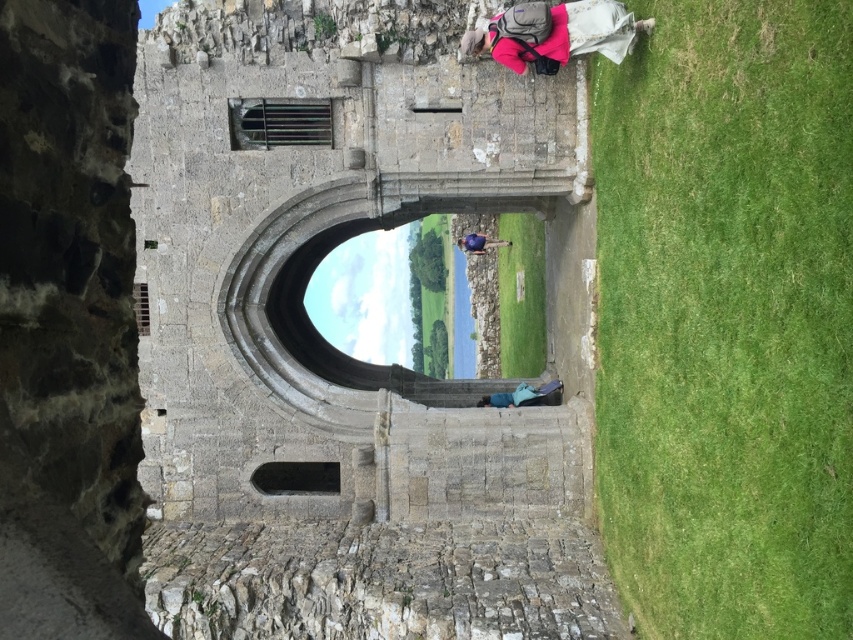
Question: Is pink fabric backpack at upper right positioned at the back of blue fabric at center?

Choices:
 (A) yes
 (B) no

Answer: (B)

Question: Which object is positioned closest to the blue fabric bag at lower center?

Choices:
 (A) pink fabric backpack at upper right
 (B) blue fabric at center

Answer: (A)

Question: Does pink fabric backpack at upper right appear under blue fabric bag at lower center?

Choices:
 (A) no
 (B) yes

Answer: (A)

Question: Which object appears closest to the camera in this image?

Choices:
 (A) pink fabric backpack at upper right
 (B) blue fabric at center
 (C) blue fabric bag at lower center

Answer: (A)

Question: Which object appears farthest from the camera in this image?

Choices:
 (A) pink fabric backpack at upper right
 (B) blue fabric at center

Answer: (B)

Question: Does pink fabric backpack at upper right appear under blue fabric bag at lower center?

Choices:
 (A) no
 (B) yes

Answer: (A)